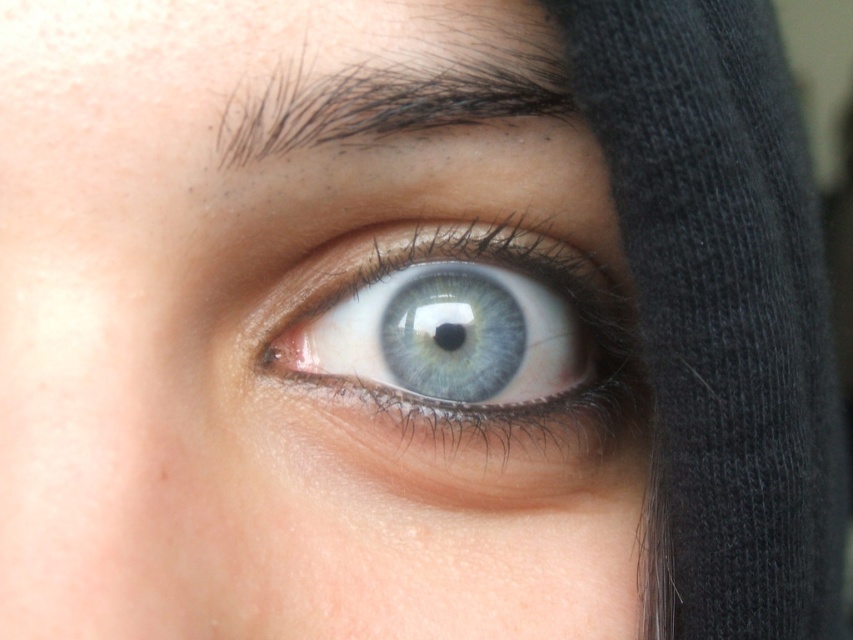
You are an AI analyzing facial features. The blue glassy eye at center is positioned at coordinates. What are its coordinates?

The blue glassy eye at center is located at coordinates (x=473, y=337).

You are a photographer taking a close up of an eye. You want to ensure the subject is in focus. If your camera is currently positioned at the point where the subject is 13.19 inches away from the camera, and you need to adjust the focus to a point at coordinates point (605, 308), will you need to move the camera closer or farther away?

The point (605, 308) is currently 13.19 inches away from the camera. To focus on that point, the camera should remain at the same distance since the given distance already corresponds to the desired focus point.

Based on the scene description, which object is wider, the blue glassy eye at center or the dark brown hair at upper center?

The blue glassy eye at center is wider than the dark brown hair at upper center according to the description.